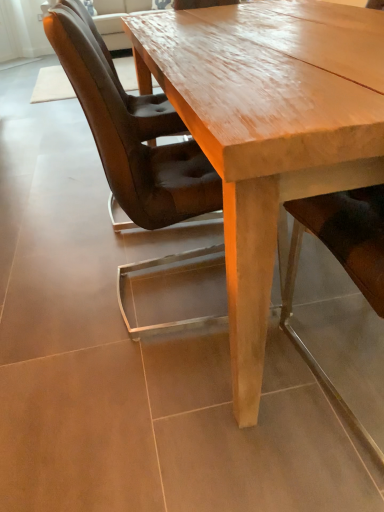
Where is `light brown polished wood table at center`? The image size is (384, 512). light brown polished wood table at center is located at coordinates (269, 129).

Locate an element on the screen. This screenshot has width=384, height=512. smooth leather chair at center, positioned as the second chair in back-to-front order is located at coordinates (342, 239).

Consider the image. Considering the relative sizes of light brown polished wood table at center and smooth leather chair at center, which is the 2th chair from left to right, in the image provided, is light brown polished wood table at center smaller than smooth leather chair at center, which is the 2th chair from left to right,?

Actually, light brown polished wood table at center might be larger than smooth leather chair at center, which is the 2th chair from left to right.

Based on their positions, is light brown polished wood table at center located to the left or right of smooth leather chair at center, the 1th chair from the right?

Clearly, light brown polished wood table at center is on the left of smooth leather chair at center, the 1th chair from the right, in the image.

From the image's perspective, which one is positioned lower, light brown polished wood table at center or smooth leather chair at center, the first chair when ordered from front to back?

smooth leather chair at center, the first chair when ordered from front to back.

From a real-world perspective, is brown leather chair at left, which appears as the second chair when viewed from the right, positioned under light brown polished wood table at center based on gravity?

No, from a real-world perspective, brown leather chair at left, which appears as the second chair when viewed from the right, is not below light brown polished wood table at center.

In the image, is brown leather chair at left, which ranks as the 1th chair in left-to-right order, on the left side or the right side of light brown polished wood table at center?

Based on their positions, brown leather chair at left, which ranks as the 1th chair in left-to-right order, is located to the left of light brown polished wood table at center.

Is brown leather chair at left, the first chair viewed from the back, facing towards light brown polished wood table at center?

Yes, brown leather chair at left, the first chair viewed from the back, is turned towards light brown polished wood table at center.

Is light brown polished wood table at center turned away from brown leather chair at left, which ranks as the 1th chair in left-to-right order?

No, brown leather chair at left, which ranks as the 1th chair in left-to-right order, is not at the back of light brown polished wood table at center.

Can brown leather chair at left, which appears as the second chair when viewed from the right, be found inside light brown polished wood table at center?

Yes, brown leather chair at left, which appears as the second chair when viewed from the right, can be found within light brown polished wood table at center.

Is light brown polished wood table at center smaller than brown leather chair at left, which ranks as the 1th chair in left-to-right order?

Incorrect, light brown polished wood table at center is not smaller in size than brown leather chair at left, which ranks as the 1th chair in left-to-right order.

From the image's perspective, is smooth leather chair at center, the first chair when ordered from front to back, beneath brown leather chair at left, the first chair viewed from the back?

Correct, smooth leather chair at center, the first chair when ordered from front to back, appears lower than brown leather chair at left, the first chair viewed from the back, in the image.

In the scene shown: Is smooth leather chair at center, the first chair when ordered from front to back, bigger or smaller than brown leather chair at left, which ranks as the 1th chair in left-to-right order?

Considering their sizes, smooth leather chair at center, the first chair when ordered from front to back, takes up less space than brown leather chair at left, which ranks as the 1th chair in left-to-right order.

Does smooth leather chair at center, positioned as the second chair in back-to-front order, turn towards brown leather chair at left, which appears as the second chair when viewed from the right?

No, smooth leather chair at center, positioned as the second chair in back-to-front order, is not turned towards brown leather chair at left, which appears as the second chair when viewed from the right.

Image resolution: width=384 pixels, height=512 pixels. I want to click on chair on the right of brown leather chair at left, which ranks as the 1th chair in left-to-right order, so click(342, 239).

Does brown leather chair at left, the first chair viewed from the back, contain smooth leather chair at center, the 1th chair from the right?

No, smooth leather chair at center, the 1th chair from the right, is not inside brown leather chair at left, the first chair viewed from the back.

How much distance is there between brown leather chair at left, which appears as the second chair when viewed from the right, and smooth leather chair at center, the first chair when ordered from front to back?

brown leather chair at left, which appears as the second chair when viewed from the right, and smooth leather chair at center, the first chair when ordered from front to back, are 19.81 inches apart from each other.

Considering the sizes of brown leather chair at left, the first chair viewed from the back, and smooth leather chair at center, positioned as the second chair in back-to-front order, in the image, is brown leather chair at left, the first chair viewed from the back, bigger or smaller than smooth leather chair at center, positioned as the second chair in back-to-front order,?

In the image, brown leather chair at left, the first chair viewed from the back, appears to be larger than smooth leather chair at center, positioned as the second chair in back-to-front order.

From the picture: In terms of height, does smooth leather chair at center, which is the 2th chair from left to right, look taller or shorter compared to light brown polished wood table at center?

Clearly, smooth leather chair at center, which is the 2th chair from left to right, is taller compared to light brown polished wood table at center.

How far apart are smooth leather chair at center, which is the 2th chair from left to right, and light brown polished wood table at center?

smooth leather chair at center, which is the 2th chair from left to right, and light brown polished wood table at center are 40.64 centimeters apart.

Based on the photo, is smooth leather chair at center, the first chair when ordered from front to back, further to camera compared to light brown polished wood table at center?

No, smooth leather chair at center, the first chair when ordered from front to back, is closer to the viewer.

Does point (289, 265) appear closer or farther from the camera than point (236, 89)?

Clearly, point (289, 265) is more distant from the camera than point (236, 89).

Locate an element on the screen. chair that is the 1st object above the light brown polished wood table at center (from a real-world perspective) is located at coordinates (342, 239).

The height and width of the screenshot is (512, 384). Find the location of `chair behind the light brown polished wood table at center`. chair behind the light brown polished wood table at center is located at coordinates (132, 130).

Considering their positions, is smooth leather chair at center, positioned as the second chair in back-to-front order, positioned closer to brown leather chair at left, which ranks as the 1th chair in left-to-right order, than light brown polished wood table at center?

Among the two, light brown polished wood table at center is located nearer to brown leather chair at left, which ranks as the 1th chair in left-to-right order.

Estimate the real-world distances between objects in this image. Which object is further from brown leather chair at left, which is the second chair in front-to-back order, light brown polished wood table at center or smooth leather chair at center, which is the 2th chair from left to right?

Based on the image, smooth leather chair at center, which is the 2th chair from left to right, appears to be further to brown leather chair at left, which is the second chair in front-to-back order.

Considering their positions, is brown leather chair at left, which appears as the second chair when viewed from the right, positioned closer to light brown polished wood table at center than smooth leather chair at center, which is the 2th chair from left to right?

brown leather chair at left, which appears as the second chair when viewed from the right, is positioned closer to the anchor light brown polished wood table at center.

Considering their positions, is light brown polished wood table at center positioned closer to smooth leather chair at center, which is the 2th chair from left to right, than brown leather chair at left, the first chair viewed from the back?

The object closer to smooth leather chair at center, which is the 2th chair from left to right, is light brown polished wood table at center.

Estimate the real-world distances between objects in this image. Which object is further from smooth leather chair at center, positioned as the second chair in back-to-front order, brown leather chair at left, which is the second chair in front-to-back order, or light brown polished wood table at center?

Based on the image, brown leather chair at left, which is the second chair in front-to-back order, appears to be further to smooth leather chair at center, positioned as the second chair in back-to-front order.

When comparing their distances from light brown polished wood table at center, does smooth leather chair at center, the 1th chair from the right, or brown leather chair at left, which appears as the second chair when viewed from the right, seem closer?

The object closer to light brown polished wood table at center is brown leather chair at left, which appears as the second chair when viewed from the right.

Identify the location of coffee table between smooth leather chair at center, positioned as the second chair in back-to-front order, and brown leather chair at left, which ranks as the 1th chair in left-to-right order, from front to back. (269, 129).